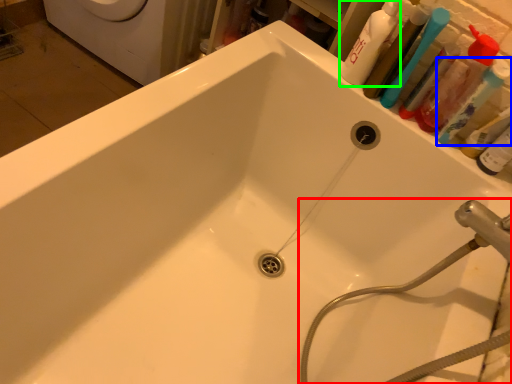
Question: Considering the real-world distances, which object is closest to plumbing fixture (highlighted by a red box)? toothbrush (highlighted by a blue box) or cleaning product (highlighted by a green box).

Choices:
 (A) toothbrush
 (B) cleaning product

Answer: (A)